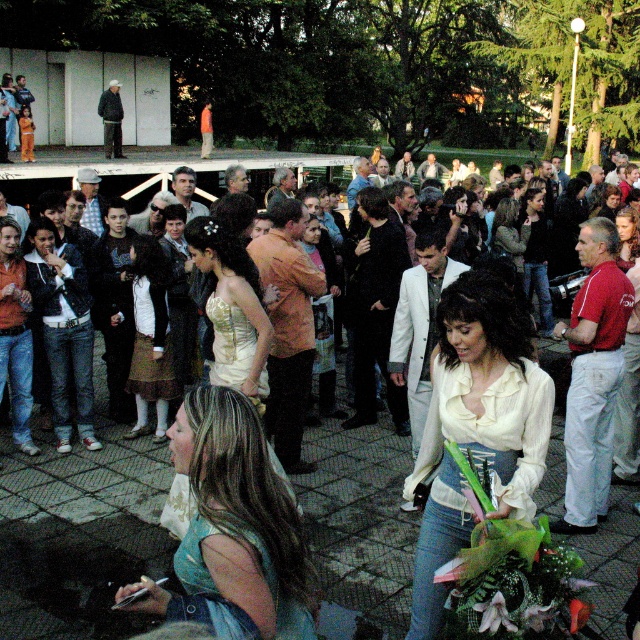
Can you confirm if blue denim dress at lower center is wider than matte gold dress at center?

Yes, blue denim dress at lower center is wider than matte gold dress at center.

Does blue denim dress at lower center appear under matte gold dress at center?

Yes.

Does point (193, 388) come in front of point (218, 326)?

Yes, point (193, 388) is in front of point (218, 326).

You are a GUI agent. You are given a task and a screenshot of the screen. Output one action in this format:
    pyautogui.click(x=<x>, y=<y>)
    Task: Click on the blue denim dress at lower center
    This screenshot has height=640, width=640.
    Given the screenshot: What is the action you would take?
    pyautogui.click(x=234, y=529)

Is point (465, 332) farther from camera compared to point (244, 365)?

That is False.

Is white satin blouse at center to the left of matte gold dress at center from the viewer's perspective?

Incorrect, white satin blouse at center is not on the left side of matte gold dress at center.

Is point (460, 480) less distant than point (252, 385)?

That is True.

The height and width of the screenshot is (640, 640). Find the location of `white satin blouse at center`. white satin blouse at center is located at coordinates (476, 424).

Who is taller, white satin blouse at center or blue denim dress at lower center?

With more height is white satin blouse at center.

Is point (440, 380) positioned behind point (276, 484)?

Yes, point (440, 380) is behind point (276, 484).

Find the location of a particular element. Image resolution: width=640 pixels, height=640 pixels. white satin blouse at center is located at coordinates (476, 424).